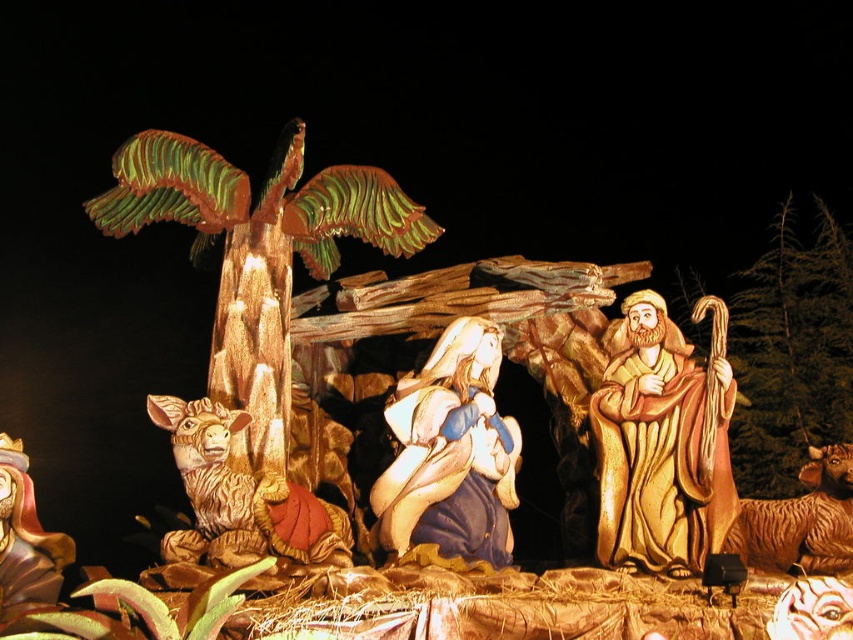
Question: Estimate the real-world distances between objects in this image. Which object is closer to the matte blue fabric at center?

Choices:
 (A) wooden palm tree at left
 (B) brown textured sheep at lower right
 (C) golden textured donkey at lower left

Answer: (C)

Question: Can you confirm if golden carved shepherd at right is positioned to the right of matte blue fabric at center?

Choices:
 (A) yes
 (B) no

Answer: (A)

Question: Which object is positioned closest to the golden textured donkey at lower left?

Choices:
 (A) matte blue fabric at center
 (B) brown textured sheep at lower right

Answer: (A)

Question: Is wooden palm tree at left further to the viewer compared to golden textured donkey at lower left?

Choices:
 (A) no
 (B) yes

Answer: (B)

Question: Is wooden palm tree at left in front of golden textured donkey at lower left?

Choices:
 (A) no
 (B) yes

Answer: (A)

Question: Which point is closer to the camera taking this photo?

Choices:
 (A) (x=263, y=509)
 (B) (x=444, y=522)
 (C) (x=260, y=534)
 (D) (x=738, y=532)

Answer: (C)